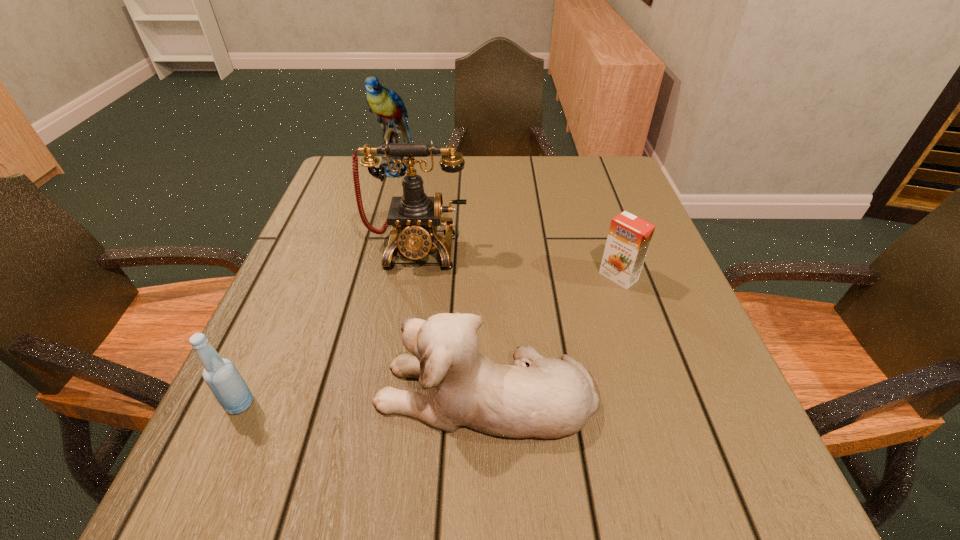
Locate an element on the screen. vacant area located on the front-facing side of the puppy is located at coordinates (244, 393).

Find the location of a particular element. The image size is (960, 540). free space located 0.160m on the right of the leftmost object is located at coordinates (354, 404).

Locate an element on the screen. The width and height of the screenshot is (960, 540). blank space located 0.070m on the left of the rightmost object is located at coordinates (566, 276).

Locate an element on the screen. This screenshot has width=960, height=540. object that is at the far edge is located at coordinates (387, 106).

At what (x,y) coordinates should I click in order to perform the action: click on parrot positioned at the left edge. Please return your answer as a coordinate pair (x, y). The height and width of the screenshot is (540, 960). Looking at the image, I should click on (387, 106).

This screenshot has width=960, height=540. In order to click on telephone located at the left edge in this screenshot , I will do `click(414, 217)`.

What are the coordinates of `bottle located at the left edge` in the screenshot? It's located at (222, 377).

At what (x,y) coordinates should I click in order to perform the action: click on object at the right edge. Please return your answer as a coordinate pair (x, y). This screenshot has height=540, width=960. Looking at the image, I should click on [x=629, y=237].

Locate an element on the screen. Image resolution: width=960 pixels, height=540 pixels. object positioned at the far left corner is located at coordinates (387, 106).

Locate an element on the screen. The height and width of the screenshot is (540, 960). free space at the far edge is located at coordinates (516, 181).